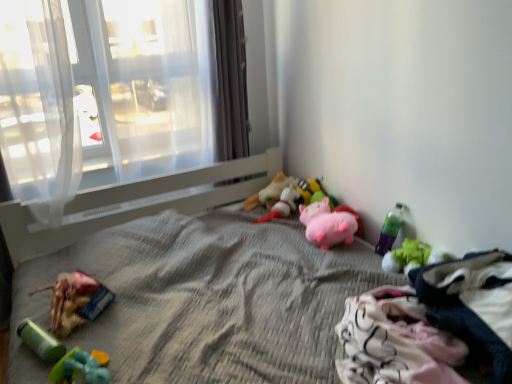
Locate an element on the screen. This screenshot has height=384, width=512. satin gray curtain at center, the first curtain in the right-to-left sequence is located at coordinates (228, 79).

The image size is (512, 384). What do you see at coordinates (228, 79) in the screenshot?
I see `satin gray curtain at center, which appears as the 2th curtain when viewed from the left` at bounding box center [228, 79].

Measure the distance between rubberized plastic toy at lower left, which is the 7th toy in right-to-left order, and camera.

A distance of 5.25 feet exists between rubberized plastic toy at lower left, which is the 7th toy in right-to-left order, and camera.

Where is `green plush toy at lower right, the first toy in the right-to-left sequence`? The image size is (512, 384). green plush toy at lower right, the first toy in the right-to-left sequence is located at coordinates (412, 256).

What do you see at coordinates (431, 324) in the screenshot? The image size is (512, 384). I see `white cotton clothing at lower right` at bounding box center [431, 324].

Describe the element at coordinates (116, 98) in the screenshot. The height and width of the screenshot is (384, 512). I see `translucent fabric at upper left` at that location.

Image resolution: width=512 pixels, height=384 pixels. I want to click on satin gray curtain at center, the first curtain in the right-to-left sequence, so click(228, 79).

Where is `toy that is the 2nd object to the right of the satin gray curtain at center, which appears as the 2th curtain when viewed from the left, starting at the anchor`? The image size is (512, 384). toy that is the 2nd object to the right of the satin gray curtain at center, which appears as the 2th curtain when viewed from the left, starting at the anchor is located at coordinates (283, 205).

Considering the relative sizes of soft plush toy at center, arranged as the 4th toy when viewed from the left, and satin gray curtain at center, which appears as the 2th curtain when viewed from the left, in the image provided, is soft plush toy at center, arranged as the 4th toy when viewed from the left, smaller than satin gray curtain at center, which appears as the 2th curtain when viewed from the left,?

Yes.

Is soft plush toy at center, arranged as the 4th toy when viewed from the left, facing towards satin gray curtain at center, which appears as the 2th curtain when viewed from the left?

No, soft plush toy at center, arranged as the 4th toy when viewed from the left, does not turn towards satin gray curtain at center, which appears as the 2th curtain when viewed from the left.

Starting from the soft plush toy at center, arranged as the 4th toy when viewed from the left, which toy is the 2nd one behind? Please provide its 2D coordinates.

[(270, 192)]

From the picture: Could you tell me if plush toy at center, the sixth toy from the right, is turned towards soft plush toy at center, arranged as the 4th toy when viewed from the left?

No, plush toy at center, the sixth toy from the right, is not facing towards soft plush toy at center, arranged as the 4th toy when viewed from the left.

Between plush toy at center, the sixth toy from the right, and soft plush toy at center, arranged as the 4th toy when viewed from the left, which one has less height?

soft plush toy at center, arranged as the 4th toy when viewed from the left.

Is plush toy at center, arranged as the third toy when viewed from the left, positioned with its back to green plush toy at lower right, the first toy in the right-to-left sequence?

No, green plush toy at lower right, the first toy in the right-to-left sequence, is not at the back of plush toy at center, arranged as the third toy when viewed from the left.

Is there a large distance between plush toy at center, the sixth toy from the right, and green plush toy at lower right, the first toy in the right-to-left sequence?

No.

Considering the positions of objects plush toy at center, arranged as the third toy when viewed from the left, and green plush toy at lower right, the first toy in the right-to-left sequence, in the image provided, who is more to the right, plush toy at center, arranged as the third toy when viewed from the left, or green plush toy at lower right, the first toy in the right-to-left sequence,?

green plush toy at lower right, the first toy in the right-to-left sequence.

From the image's perspective, is plush toy at center, arranged as the third toy when viewed from the left, below green plush toy at lower right, the first toy in the right-to-left sequence?

Result: No, from the image's perspective, plush toy at center, arranged as the third toy when viewed from the left, is not below green plush toy at lower right, the first toy in the right-to-left sequence.

Does point (273, 224) come behind point (282, 177)?

No, (273, 224) is in front of (282, 177).

Where is `the 8th toy behind the gray textured bed at center`? This screenshot has height=384, width=512. the 8th toy behind the gray textured bed at center is located at coordinates (270, 192).

Consider the image. Do you think gray textured bed at center is within plush toy at center, arranged as the third toy when viewed from the left, or outside of it?

gray textured bed at center is not inside plush toy at center, arranged as the third toy when viewed from the left, it's outside.

Is white sheer curtain at left, acting as the second curtain starting from the right, at the back of green plastic toy at lower left, which ranks as the 1th toy in left-to-right order?

No, green plastic toy at lower left, which ranks as the 1th toy in left-to-right order, is not facing the opposite direction of white sheer curtain at left, acting as the second curtain starting from the right.

Which of these two, green plastic toy at lower left, positioned as the 8th toy in right-to-left order, or white sheer curtain at left, the 1th curtain from the left, is wider?

white sheer curtain at left, the 1th curtain from the left, is wider.

Is green plastic toy at lower left, which ranks as the 1th toy in left-to-right order, taller or shorter than white sheer curtain at left, the 1th curtain from the left?

green plastic toy at lower left, which ranks as the 1th toy in left-to-right order, is shorter than white sheer curtain at left, the 1th curtain from the left.

Is green plastic toy at lower left, which ranks as the 1th toy in left-to-right order, further to the viewer compared to white sheer curtain at left, acting as the second curtain starting from the right?

No, the depth of green plastic toy at lower left, which ranks as the 1th toy in left-to-right order, is less than that of white sheer curtain at left, acting as the second curtain starting from the right.

Considering the relative positions of rubberized plastic toy at lower left, which is the 7th toy in right-to-left order, and satin gray curtain at center, which appears as the 2th curtain when viewed from the left, in the image provided, is rubberized plastic toy at lower left, which is the 7th toy in right-to-left order, behind satin gray curtain at center, which appears as the 2th curtain when viewed from the left,?

No, it is not.

Is point (108, 294) closer or farther from the camera than point (214, 133)?

Clearly, point (108, 294) is closer to the camera than point (214, 133).

Is rubberized plastic toy at lower left, which is the 7th toy in right-to-left order, at the left side of satin gray curtain at center, the first curtain in the right-to-left sequence?

Indeed, rubberized plastic toy at lower left, which is the 7th toy in right-to-left order, is positioned on the left side of satin gray curtain at center, the first curtain in the right-to-left sequence.

Is rubberized plastic toy at lower left, which is the 7th toy in right-to-left order, wider or thinner than satin gray curtain at center, which appears as the 2th curtain when viewed from the left?

In the image, rubberized plastic toy at lower left, which is the 7th toy in right-to-left order, appears to be wider than satin gray curtain at center, which appears as the 2th curtain when viewed from the left.

From a real-world perspective, which is physically above, white cotton clothing at lower right or rubberized plastic toy at lower left, which is the 7th toy in right-to-left order?

white cotton clothing at lower right, from a real-world perspective.

Is white cotton clothing at lower right far away from rubberized plastic toy at lower left, the second toy positioned from the left?

Yes, white cotton clothing at lower right is far from rubberized plastic toy at lower left, the second toy positioned from the left.

Which object is wider, white cotton clothing at lower right or rubberized plastic toy at lower left, which is the 7th toy in right-to-left order?

white cotton clothing at lower right.

Can you confirm if white cotton clothing at lower right is taller than rubberized plastic toy at lower left, the second toy positioned from the left?

Correct, white cotton clothing at lower right is much taller as rubberized plastic toy at lower left, the second toy positioned from the left.

Identify the location of the 3rd toy positioned below the satin gray curtain at center, the first curtain in the right-to-left sequence (from the image's perspective). Image resolution: width=512 pixels, height=384 pixels. (283, 205).

Starting from the soft plush toy at center, marked as the fifth toy in a right-to-left arrangement, which toy is the 1st one to the left? Please provide its 2D coordinates.

[(270, 192)]

Estimate the real-world distances between objects in this image. Which object is closer to satin gray curtain at center, which appears as the 2th curtain when viewed from the left, pink plush pig at center, placed as the third toy when sorted from right to left, or white cotton clothing at lower right?

pink plush pig at center, placed as the third toy when sorted from right to left, lies closer to satin gray curtain at center, which appears as the 2th curtain when viewed from the left, than the other object.

Which object lies further to the anchor point pink plush pig at center, the 6th toy from the left, soft plush toy at center, arranged as the 4th toy when viewed from the left, or white cotton clothing at lower right?

Based on the image, white cotton clothing at lower right appears to be further to pink plush pig at center, the 6th toy from the left.

When comparing their distances from soft plush toy at center, acting as the 4th toy starting from the right, does plush toy at center, arranged as the third toy when viewed from the left, or gray textured bed at center seem closer?

Among the two, plush toy at center, arranged as the third toy when viewed from the left, is located nearer to soft plush toy at center, acting as the 4th toy starting from the right.

Looking at this image, based on their spatial positions, is white cotton clothing at lower right or soft plush toy at center, marked as the fifth toy in a right-to-left arrangement, closer to rubberized plastic toy at lower left, which is the 7th toy in right-to-left order?

soft plush toy at center, marked as the fifth toy in a right-to-left arrangement, is positioned closer to the anchor rubberized plastic toy at lower left, which is the 7th toy in right-to-left order.

Based on their spatial positions, is white sheer curtain at left, the 1th curtain from the left, or green plastic toy at lower left, which ranks as the 1th toy in left-to-right order, closer to soft plush toy at center, marked as the fifth toy in a right-to-left arrangement?

Based on the image, white sheer curtain at left, the 1th curtain from the left, appears to be nearer to soft plush toy at center, marked as the fifth toy in a right-to-left arrangement.

Considering their positions, is plush toy at center, arranged as the third toy when viewed from the left, positioned further to green plastic bottle at lower right, which is the seventh toy in left-to-right order, than white cotton clothing at lower right?

Based on the image, plush toy at center, arranged as the third toy when viewed from the left, appears to be further to green plastic bottle at lower right, which is the seventh toy in left-to-right order.

From the image, which object appears to be nearer to green plastic bottle at lower right, which is the seventh toy in left-to-right order, gray textured bed at center or rubberized plastic toy at lower left, which is the 7th toy in right-to-left order?

gray textured bed at center is positioned closer to the anchor green plastic bottle at lower right, which is the seventh toy in left-to-right order.

Considering their positions, is white sheer curtain at left, the 1th curtain from the left, positioned further to green plush toy at lower right, the 8th toy viewed from the left, than soft plush toy at center, arranged as the 4th toy when viewed from the left?

Based on the image, white sheer curtain at left, the 1th curtain from the left, appears to be further to green plush toy at lower right, the 8th toy viewed from the left.

Where is `material located between translucent fabric at upper left and green plush toy at lower right, the 8th toy viewed from the left, in the left-right direction`? The width and height of the screenshot is (512, 384). material located between translucent fabric at upper left and green plush toy at lower right, the 8th toy viewed from the left, in the left-right direction is located at coordinates (431, 324).

You are a GUI agent. You are given a task and a screenshot of the screen. Output one action in this format:
    pyautogui.click(x=<x>, y=<y>)
    Task: Click on the window between white sheer curtain at left, the 1th curtain from the left, and plush toy at center, arranged as the third toy when viewed from the left
    
    Given the screenshot: What is the action you would take?
    pyautogui.click(x=116, y=98)

At what (x,y) coordinates should I click in order to perform the action: click on bed between rubberized plastic toy at lower left, which is the 7th toy in right-to-left order, and green plush toy at lower right, the 8th toy viewed from the left, in the horizontal direction. Please return your answer as a coordinate pair (x, y). Looking at the image, I should click on (131, 211).

You are a GUI agent. You are given a task and a screenshot of the screen. Output one action in this format:
    pyautogui.click(x=<x>, y=<y>)
    Task: Click on the bed situated between white sheer curtain at left, the 1th curtain from the left, and green plastic bottle at lower right, which is the seventh toy in left-to-right order, from left to right
    
    Given the screenshot: What is the action you would take?
    pyautogui.click(x=131, y=211)